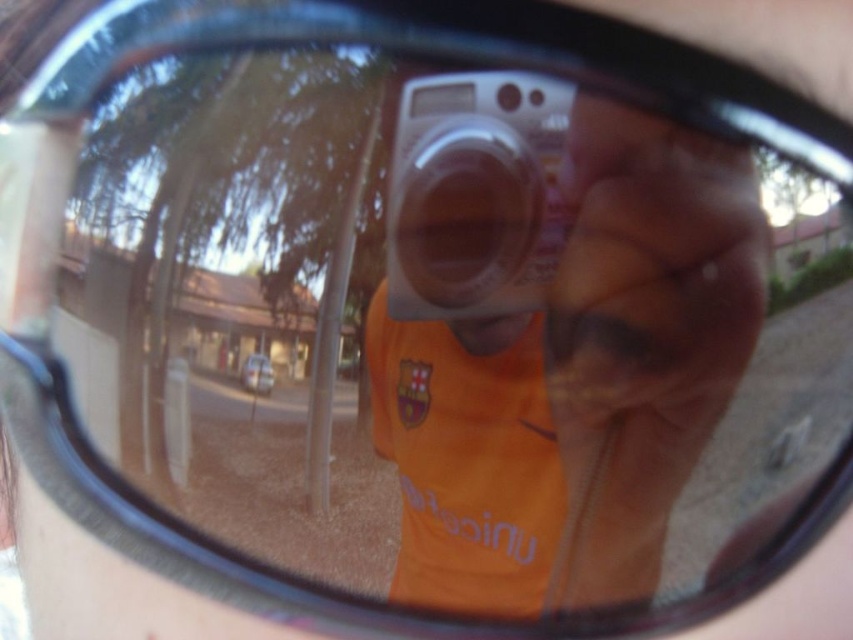
Question: In this image, where is orange fabric at center located relative to silver metallic camera at center?

Choices:
 (A) above
 (B) below

Answer: (B)

Question: Is orange fabric at center bigger than silver metallic camera at center?

Choices:
 (A) yes
 (B) no

Answer: (A)

Question: Does orange fabric at center have a smaller size compared to silver metallic camera at center?

Choices:
 (A) no
 (B) yes

Answer: (A)

Question: Among these objects, which one is nearest to the camera?

Choices:
 (A) silver metallic camera at center
 (B) orange fabric at center

Answer: (B)

Question: Which point is closer to the camera taking this photo?

Choices:
 (A) (490, 252)
 (B) (701, 284)

Answer: (B)